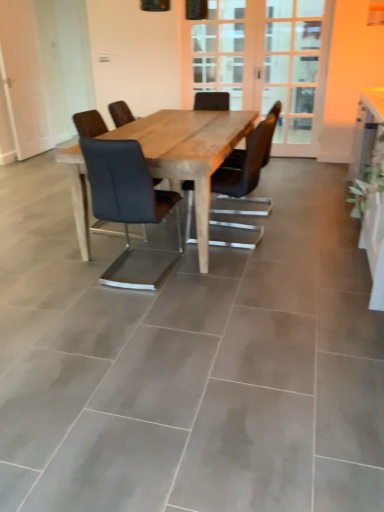
I want to click on vacant point to the right of matte black chair at center, the first chair viewed from the left, so click(x=221, y=274).